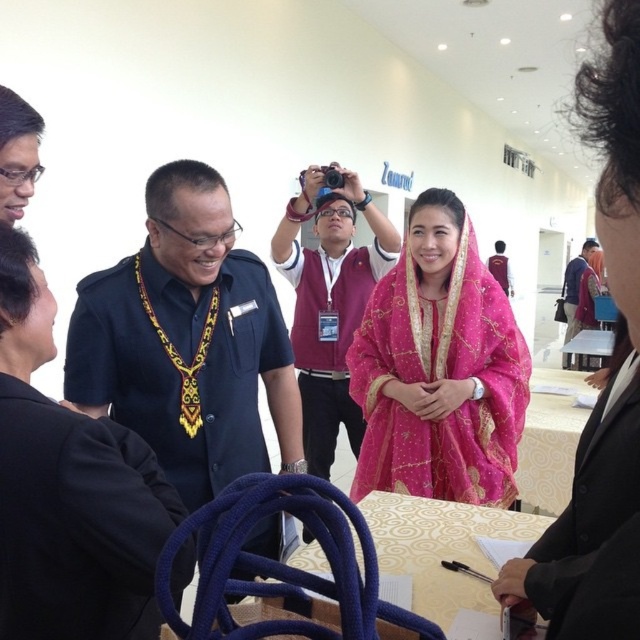
Question: Is pink silk robe at lower right positioned before maroon fabric shirt at center?

Choices:
 (A) yes
 (B) no

Answer: (A)

Question: Does pink silk robe at lower right appear on the right side of pink embroidered robe at center?

Choices:
 (A) yes
 (B) no

Answer: (A)

Question: Among these points, which one is farthest from the camera?

Choices:
 (A) (630, 106)
 (B) (136, 563)
 (C) (378, 481)

Answer: (C)

Question: Which of these objects is positioned closest to the velvet blue robe at center?

Choices:
 (A) maroon fabric shirt at center
 (B) pink embroidered robe at center
 (C) pink embroidered dress at center

Answer: (C)

Question: Among these points, which one is nearest to the camera?

Choices:
 (A) (170, 314)
 (B) (595, 564)
 (C) (328, 260)
 (D) (582, 307)

Answer: (B)

Question: Does velvet blue robe at center have a lesser width compared to black fabric at center?

Choices:
 (A) no
 (B) yes

Answer: (B)